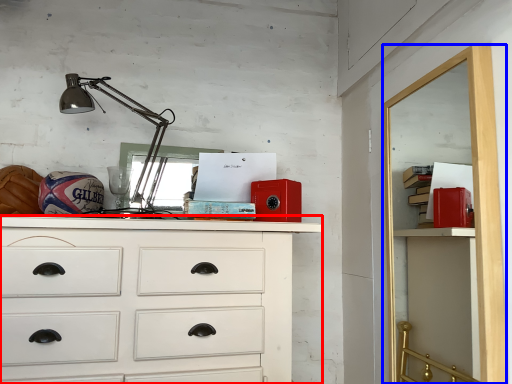
Question: Which object is closer to the camera taking this photo, chest of drawers (highlighted by a red box) or file cabinet (highlighted by a blue box)?

Choices:
 (A) chest of drawers
 (B) file cabinet

Answer: (B)